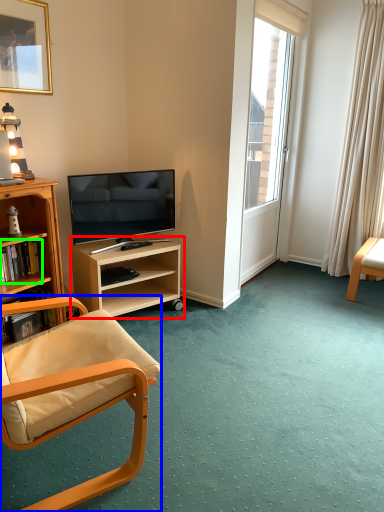
Question: Based on their relative distances, which object is nearer to shelf (highlighted by a red box)? Choose from chair (highlighted by a blue box) and book (highlighted by a green box).

Choices:
 (A) chair
 (B) book

Answer: (B)